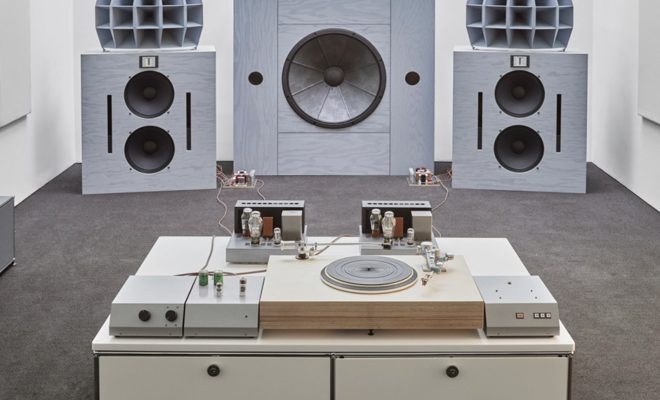
The width and height of the screenshot is (660, 400). Identify the location of floor. (630, 263).